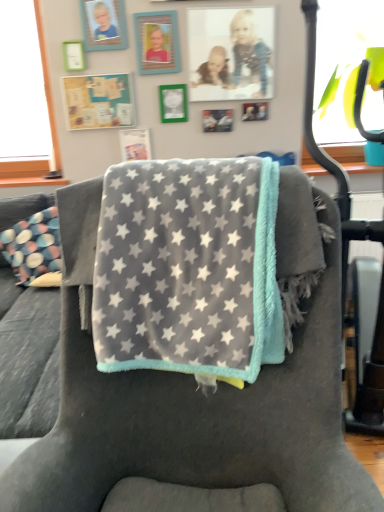
Question: Considering the positions of wooden picture frame at upper left, which is the 2th picture frame from left to right, and metallic silver photo frame at upper center, which is counted as the seventh picture frame, starting from the left, in the image, is wooden picture frame at upper left, which is the 2th picture frame from left to right, taller or shorter than metallic silver photo frame at upper center, which is counted as the seventh picture frame, starting from the left,?

Choices:
 (A) short
 (B) tall

Answer: (B)

Question: In terms of width, does wooden picture frame at upper left, which is the 2th picture frame from left to right, look wider or thinner when compared to metallic silver photo frame at upper center, the first picture frame from the right?

Choices:
 (A) wide
 (B) thin

Answer: (A)

Question: Considering the real-world distances, which object is farthest from the matte black picture frame at center, placed as the 3th picture frame when sorted from right to left?

Choices:
 (A) wooden picture frame at upper left, which is the 2th picture frame from left to right
 (B) green matte picture frame at upper left, acting as the first picture frame starting from the left
 (C) green matte picture frame at upper center, arranged as the fourth picture frame when viewed from the left
 (D) teal matte picture frame at upper center, which is the third picture frame in left-to-right order
 (E) metallic silver photo frame at upper center, which is counted as the seventh picture frame, starting from the left

Answer: (A)

Question: Which is nearer to the wooden picture frame at upper left, positioned as the 6th picture frame in right-to-left order?

Choices:
 (A) green matte picture frame at upper center, the 4th picture frame positioned from the right
 (B) gray plush blanket at center
 (C) matte plastic picture frame at upper center, the 6th picture frame in the left-to-right sequence
 (D) gray plush blanket at center
 (E) green matte picture frame at upper left, acting as the first picture frame starting from the left

Answer: (E)